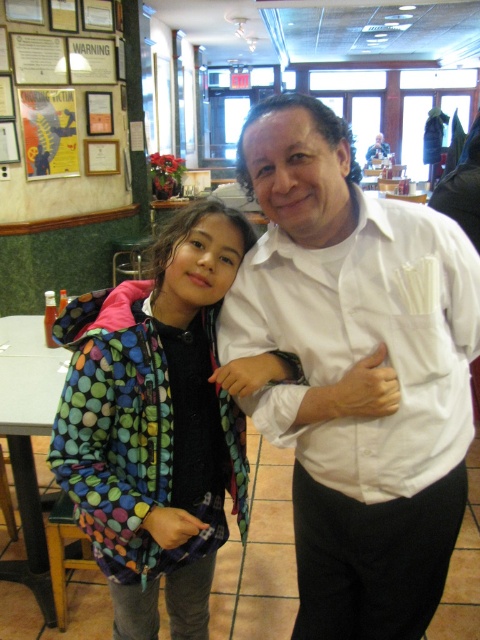
Who is more forward, (207,552) or (386,154)?

Positioned in front is point (207,552).

You are a GUI agent. You are given a task and a screenshot of the screen. Output one action in this format:
    pyautogui.click(x=<x>, y=<y>)
    Task: Click on the polka dot jacket at center
    
    Given the screenshot: What is the action you would take?
    pyautogui.click(x=156, y=426)

At what (x,y) coordinates should I click in order to perform the action: click on polka dot jacket at center. Please return your answer as a coordinate pair (x, y). This screenshot has height=640, width=480. Looking at the image, I should click on (156, 426).

Is white smooth shirt at center below white glossy shirt at center?

Indeed, white smooth shirt at center is positioned under white glossy shirt at center.

Where is `white smooth shirt at center`? white smooth shirt at center is located at coordinates (357, 371).

This screenshot has height=640, width=480. What do you see at coordinates (357, 371) in the screenshot?
I see `white smooth shirt at center` at bounding box center [357, 371].

Locate an element on the screen. The image size is (480, 640). white smooth shirt at center is located at coordinates (357, 371).

Based on the photo, does white smooth shirt at center have a greater height compared to polka dot jacket at center?

Correct, white smooth shirt at center is much taller as polka dot jacket at center.

Locate an element on the screen. The width and height of the screenshot is (480, 640). white smooth shirt at center is located at coordinates (357, 371).

Where is `white smooth shirt at center`? white smooth shirt at center is located at coordinates (357, 371).